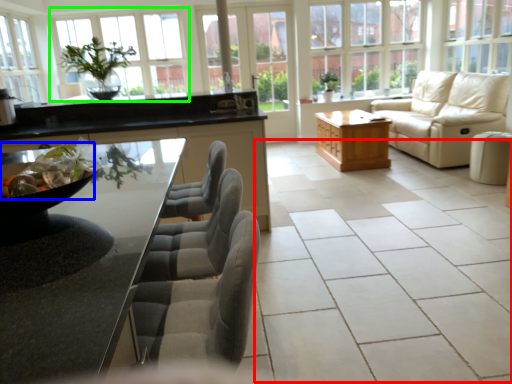
Question: Which is farther away from ceramic tile (highlighted by a red box)? food (highlighted by a blue box) or window (highlighted by a green box)?

Choices:
 (A) food
 (B) window

Answer: (B)